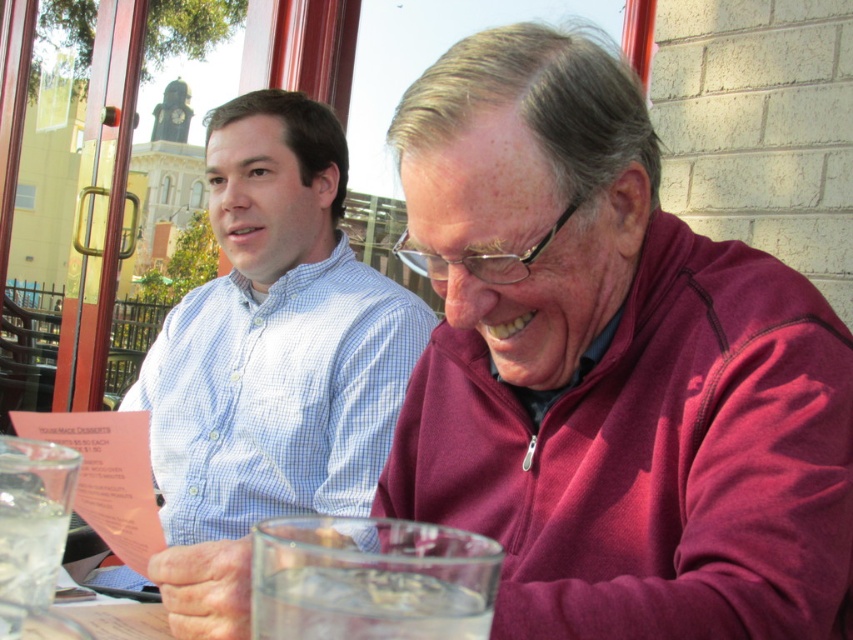
Who is taller, light blue checkered shirt at center or clear glass water at lower center?

light blue checkered shirt at center is taller.

Who is shorter, light blue checkered shirt at center or clear glass water at lower center?

clear glass water at lower center

Between point (177, 380) and point (392, 630), which one is positioned in front?

Point (392, 630)

Identify the location of light blue checkered shirt at center. The width and height of the screenshot is (853, 640). (276, 337).

Who is more forward, (381,349) or (65,513)?

Point (65,513) is more forward.

Find the location of a particular element. The width and height of the screenshot is (853, 640). light blue checkered shirt at center is located at coordinates (276, 337).

From the picture: Between clear glass water at lower center and clear glass water at lower left, which one is positioned higher?

Positioned higher is clear glass water at lower center.

Who is more forward, (303, 627) or (3, 564)?

Point (303, 627) is in front.

This screenshot has width=853, height=640. What do you see at coordinates (366, 604) in the screenshot?
I see `clear glass water at lower center` at bounding box center [366, 604].

The image size is (853, 640). Find the location of `clear glass water at lower center`. clear glass water at lower center is located at coordinates (366, 604).